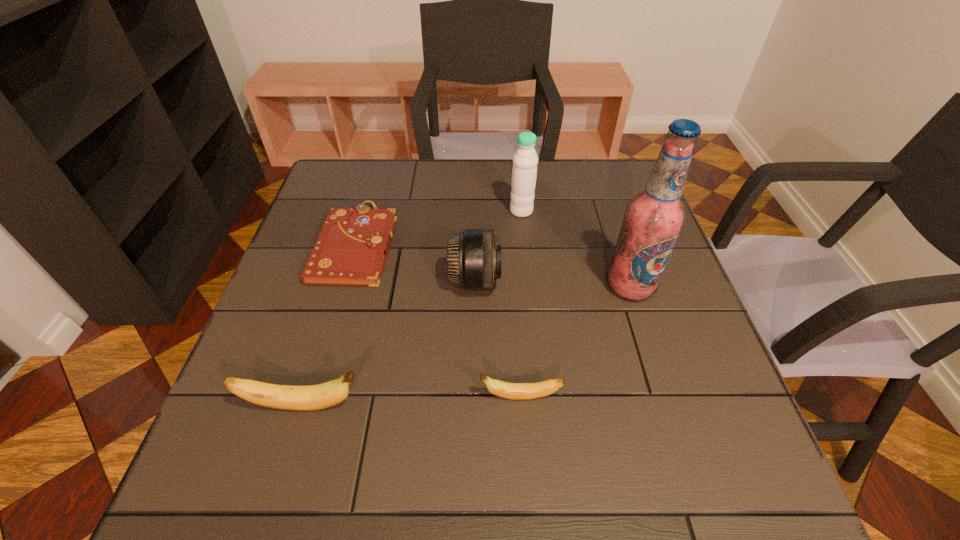
Please point out where to position a new banana on the right to maintain spacing. Please provide its 2D coordinates. Your answer should be formatted as a tuple, i.e. [(x, y)], where the tuple contains the x and y coordinates of a point satisfying the conditions above.

[(730, 388)]